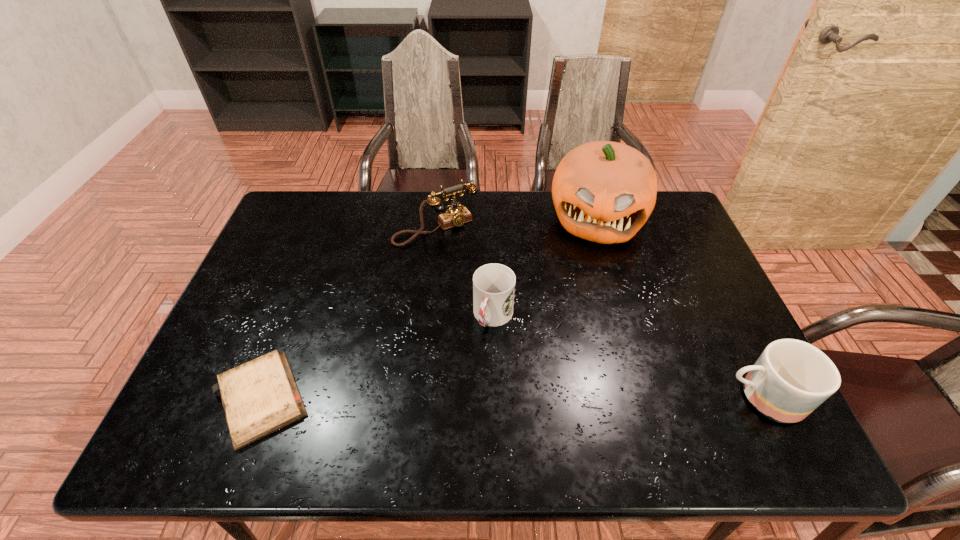
Identify the location of vacant space that satisfies the following two spatial constraints: 1. on the back side of the telephone; 2. on the left side of the shortest object. This screenshot has width=960, height=540. pyautogui.click(x=326, y=229).